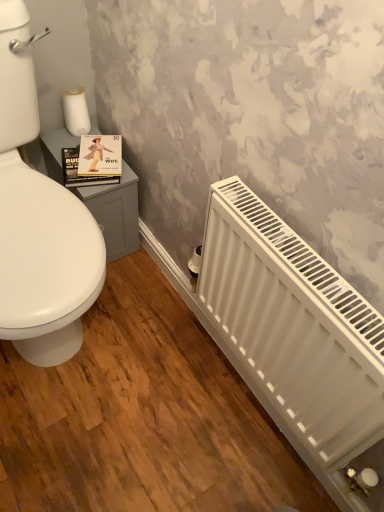
The height and width of the screenshot is (512, 384). Identify the location of free space above white matte radiator at lower right (from a real-world perspective). (301, 251).